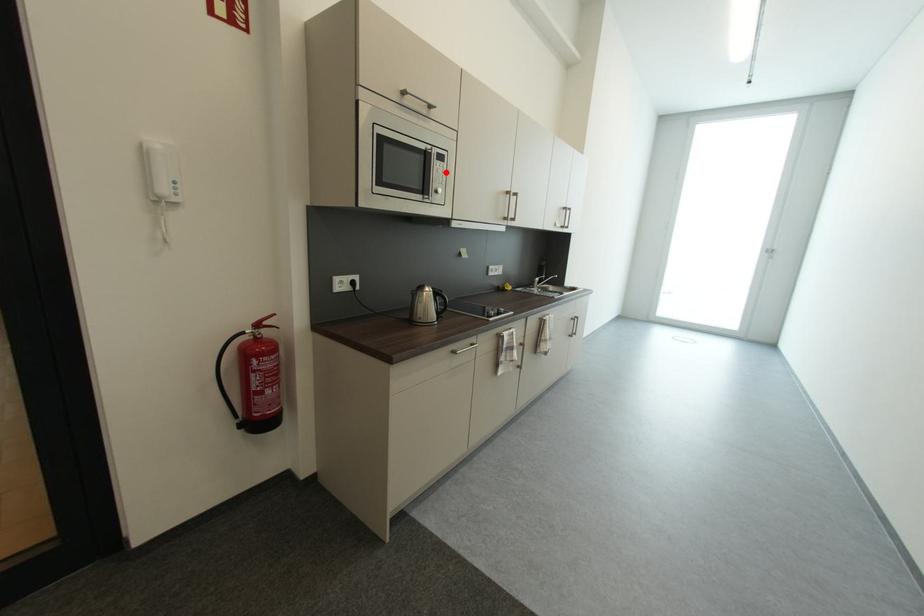
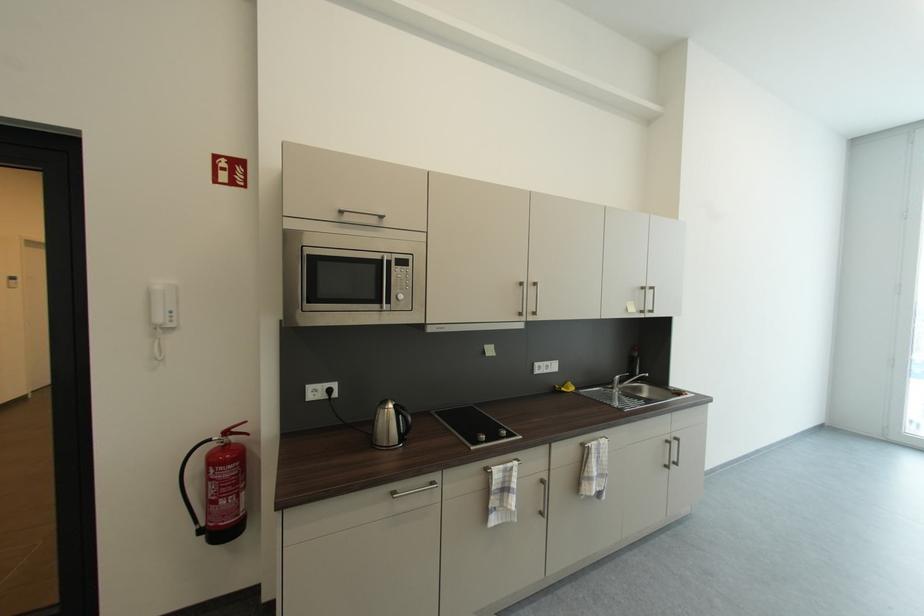
The point at the highlighted location is marked in the first image. Where is the corresponding point in the second image?

(407, 278)